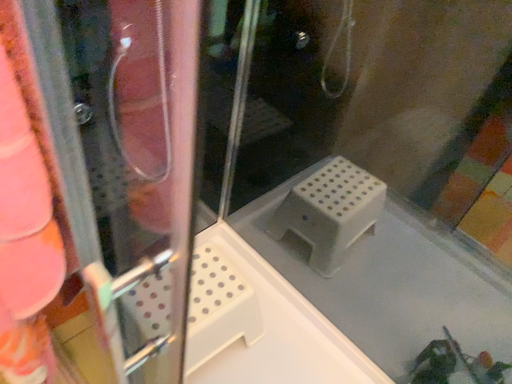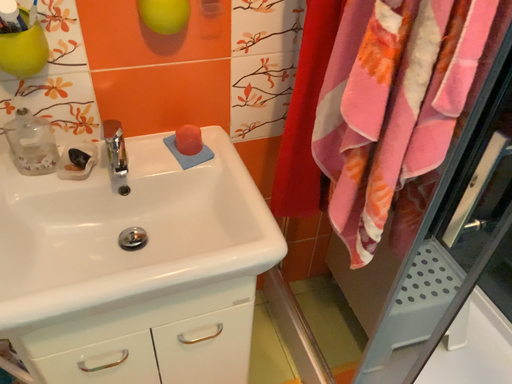
Question: Which way did the camera rotate in the video?

Choices:
 (A) rotated right
 (B) rotated left

Answer: (B)